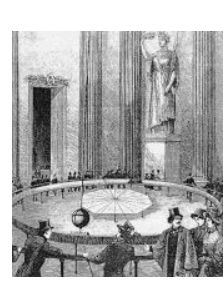
Identify the location of table. (108, 204), (127, 205), (111, 193).